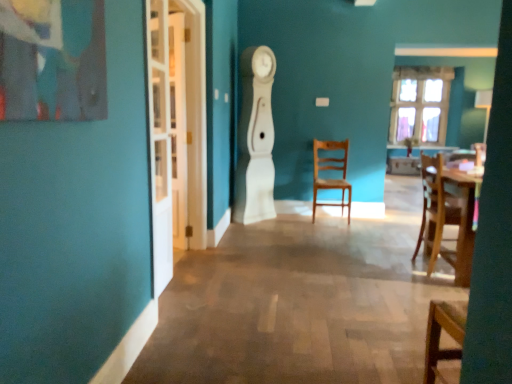
Question: Does white glossy clock at center appear on the right side of white glass door at left?

Choices:
 (A) yes
 (B) no

Answer: (A)

Question: From the image's perspective, is white glossy clock at center on white glass door at left?

Choices:
 (A) no
 (B) yes

Answer: (B)

Question: Does white glossy clock at center have a greater height compared to white glass door at left?

Choices:
 (A) yes
 (B) no

Answer: (B)

Question: Is white glossy clock at center aimed at white glass door at left?

Choices:
 (A) no
 (B) yes

Answer: (A)

Question: Is white glossy clock at center oriented away from white glass door at left?

Choices:
 (A) no
 (B) yes

Answer: (A)

Question: Is clear glass window at upper right bigger or smaller than white glossy clock at center?

Choices:
 (A) small
 (B) big

Answer: (A)

Question: Choose the correct answer: Is clear glass window at upper right inside white glossy clock at center or outside it?

Choices:
 (A) outside
 (B) inside

Answer: (A)

Question: From the image's perspective, is clear glass window at upper right positioned above or below white glossy clock at center?

Choices:
 (A) below
 (B) above

Answer: (B)

Question: Is point (440, 142) positioned closer to the camera than point (262, 195)?

Choices:
 (A) farther
 (B) closer

Answer: (A)

Question: Would you say white glossy clock at center is to the left or to the right of white glass door at left in the picture?

Choices:
 (A) left
 (B) right

Answer: (B)

Question: Is point (256, 109) closer or farther from the camera than point (150, 66)?

Choices:
 (A) farther
 (B) closer

Answer: (A)

Question: From their relative heights in the image, would you say white glossy clock at center is taller or shorter than white glass door at left?

Choices:
 (A) short
 (B) tall

Answer: (A)

Question: Is white glossy clock at center in front of or behind white glass door at left in the image?

Choices:
 (A) behind
 (B) front

Answer: (A)

Question: Considering the positions of white glass door at left and wooden table at right in the image, is white glass door at left bigger or smaller than wooden table at right?

Choices:
 (A) small
 (B) big

Answer: (A)

Question: Is white glass door at left wider or thinner than wooden table at right?

Choices:
 (A) wide
 (B) thin

Answer: (B)